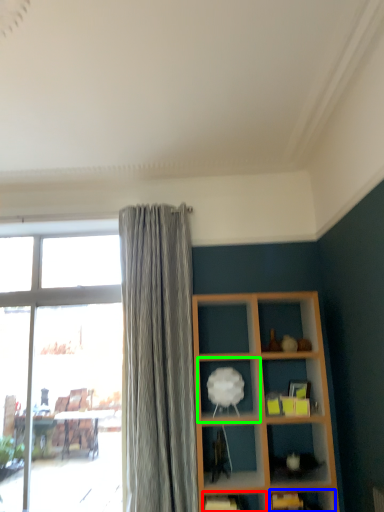
Question: Considering the real-world distances, which object is farthest from shelf (highlighted by a red box)? shelf (highlighted by a blue box) or shelf (highlighted by a green box)?

Choices:
 (A) shelf
 (B) shelf

Answer: (B)